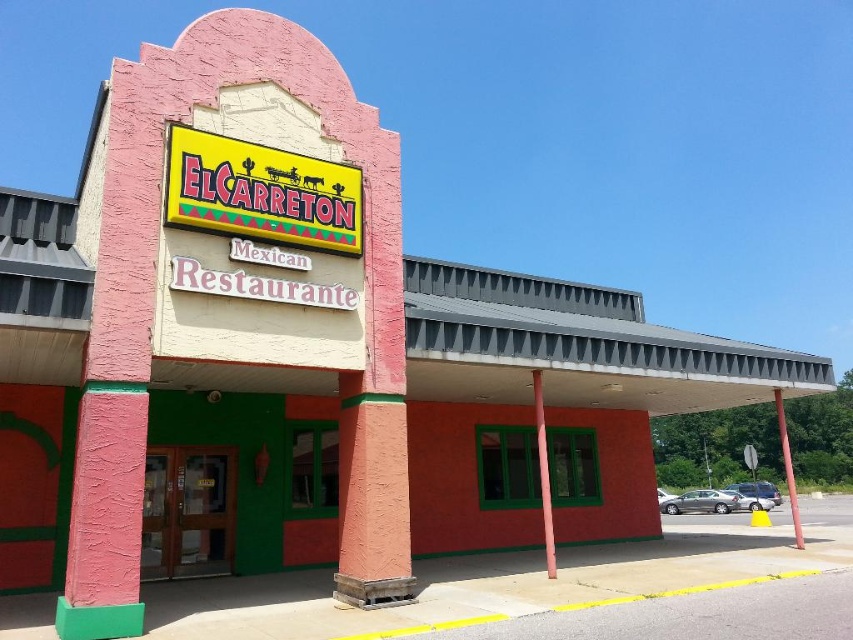
Can you confirm if yellow plastic sign at center is shorter than pink matte pole at center?

In fact, yellow plastic sign at center may be taller than pink matte pole at center.

Between yellow plastic sign at center and pink matte pole at center, which one has more height?

yellow plastic sign at center is taller.

Is point (335, 230) positioned after point (540, 401)?

No, (335, 230) is in front of (540, 401).

You are a GUI agent. You are given a task and a screenshot of the screen. Output one action in this format:
    pyautogui.click(x=<x>, y=<y>)
    Task: Click on the yellow plastic sign at center
    This screenshot has width=853, height=640.
    Given the screenshot: What is the action you would take?
    pyautogui.click(x=260, y=193)

Does yellow plastic sign at center have a lesser width compared to red painted metal pole at center?

Indeed, yellow plastic sign at center has a lesser width compared to red painted metal pole at center.

Who is more forward, (247, 205) or (788, 449)?

Point (247, 205)

The height and width of the screenshot is (640, 853). I want to click on yellow plastic sign at center, so click(x=260, y=193).

Measure the distance between point (x=540, y=394) and camera.

Point (x=540, y=394) and camera are 36.10 feet apart.

Who is more forward, (543, 440) or (796, 499)?

Point (543, 440) is more forward.

Does point (550, 566) lie in front of point (776, 420)?

Yes, point (550, 566) is in front of point (776, 420).

Image resolution: width=853 pixels, height=640 pixels. Identify the location of pink matte pole at center. (543, 474).